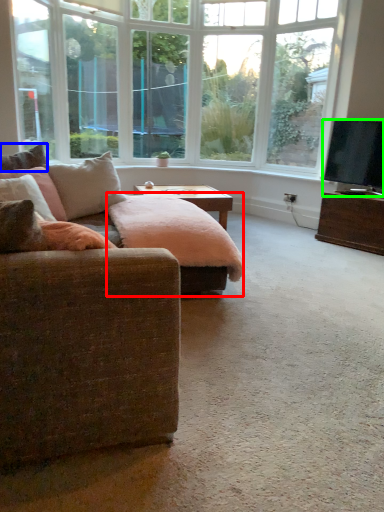
Question: Which object is positioned closest to swivel chair (highlighted by a red box)? Select from pillow (highlighted by a blue box) and television (highlighted by a green box).

Choices:
 (A) pillow
 (B) television

Answer: (A)